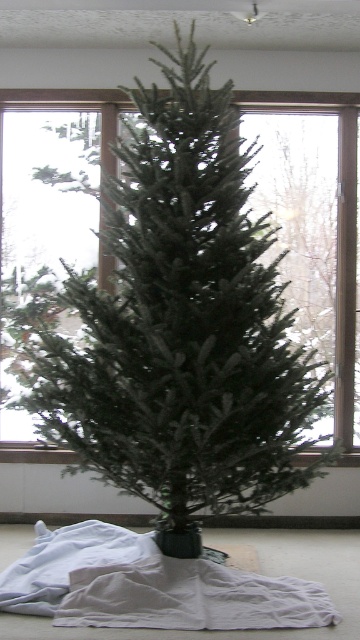
You are trying to cover the transparent glass window at center with the white soft blanket at lower center. Based on the information provided, will the blanket be large enough to cover the entire window?

The white soft blanket at lower center has a larger width than the transparent glass window at center, so it should be large enough to cover the entire window.

You are standing in the room where the Christmas tree is placed. You need to place a gift under the tree. Where should you put the gift relative to the white soft blanket at lower center?

The white soft blanket at lower center is located at point (150, 586), so you should place the gift near that coordinate under the tree.